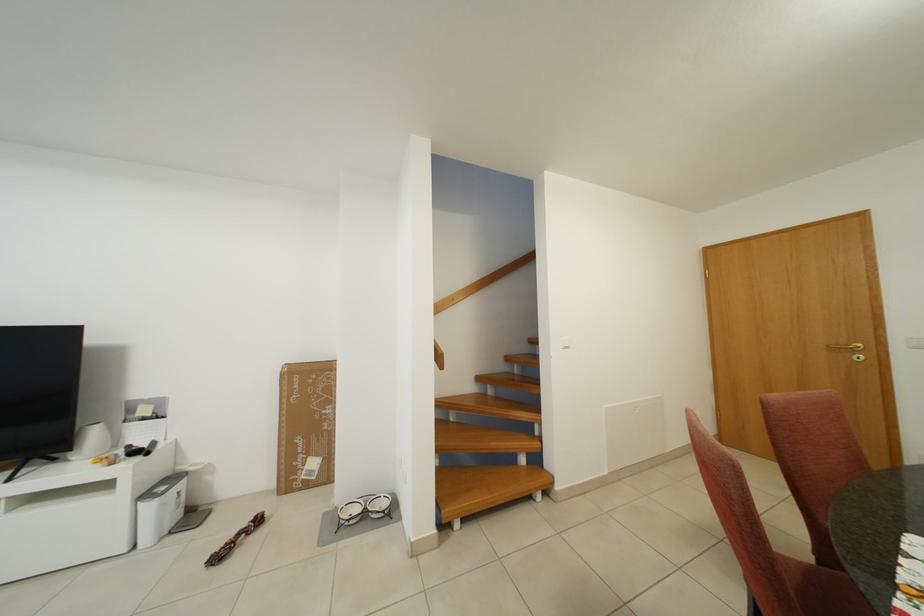
The location [235,540] corresponds to which object?

It refers to a braided dog toy.